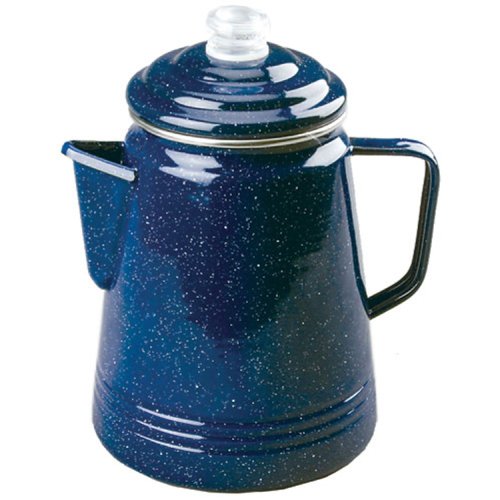
This screenshot has width=500, height=500. In order to click on dark blue carafe with white specks in this screenshot , I will do `click(267, 312)`.